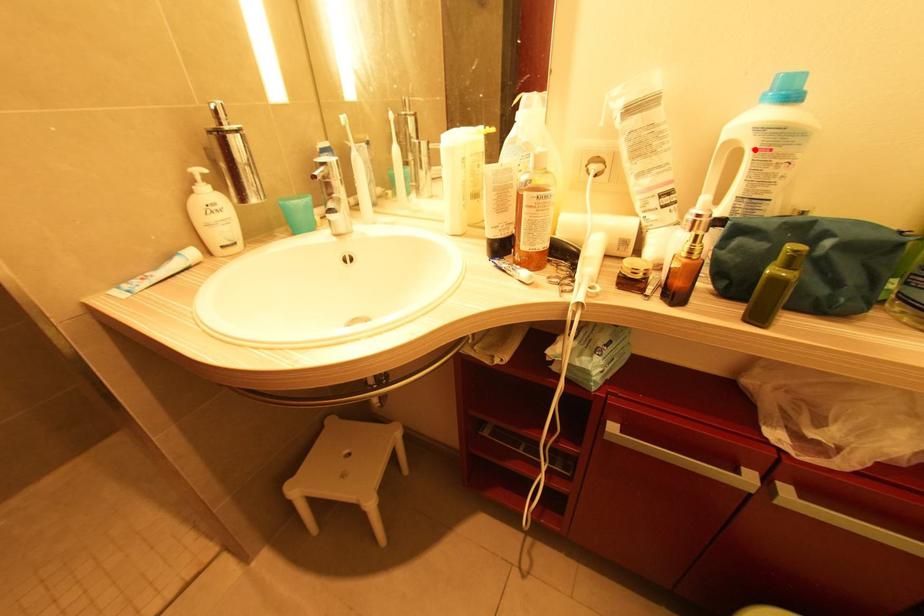
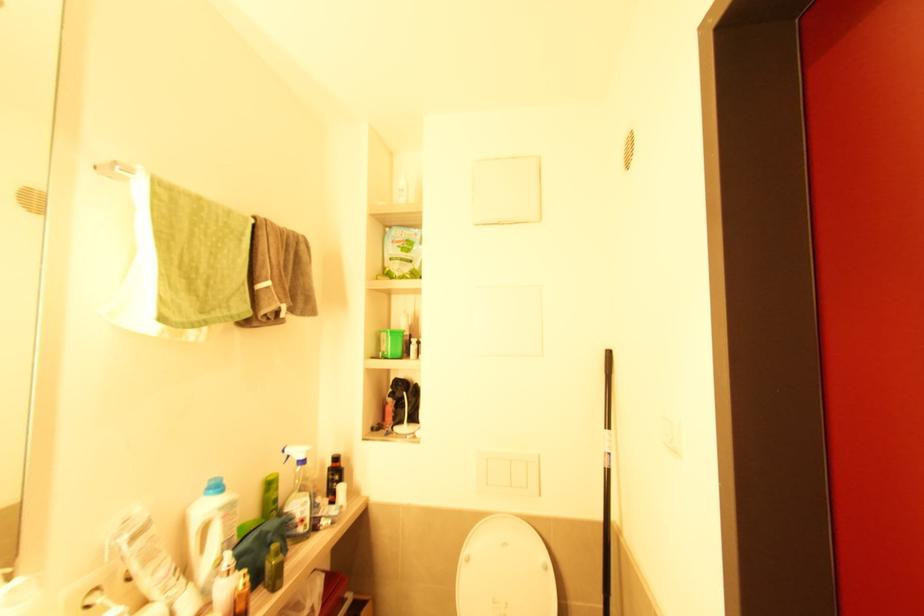
Locate, in the second image, the point that corresponds to the highlighted location in the first image.

(224, 519)